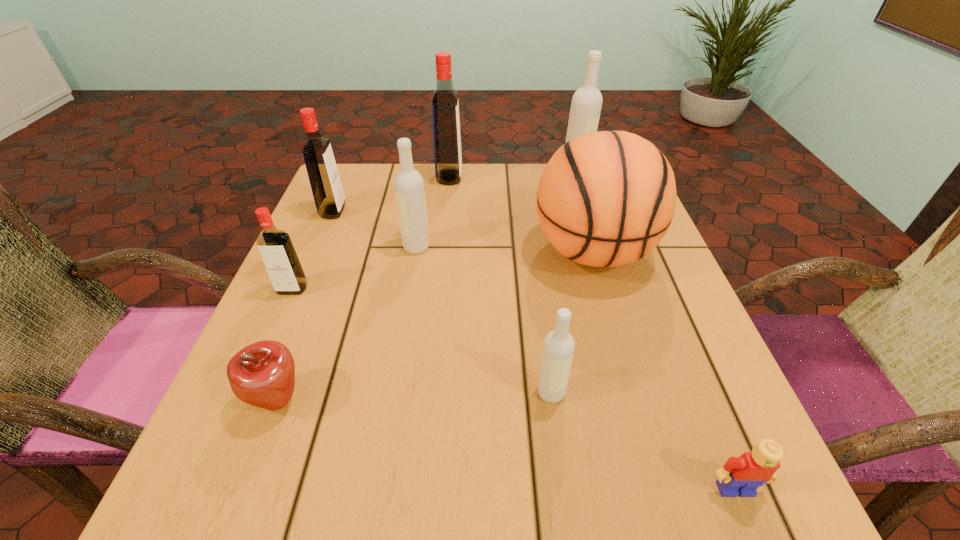
Locate an element on the screen. empty location between the second white vodka from right to left and the second nearest red vodka is located at coordinates (442, 302).

The image size is (960, 540). What are the coordinates of `free point between the biggest red vodka and the rightmost vodka` in the screenshot? It's located at (512, 176).

This screenshot has height=540, width=960. I want to click on blank region between the orange basketball and the apple, so click(x=435, y=326).

What are the coordinates of `vacant area that lies between the orange basketball and the farthest red vodka` in the screenshot? It's located at (520, 214).

Image resolution: width=960 pixels, height=540 pixels. I want to click on vacant area between the rightmost vodka and the third farthest vodka, so click(x=454, y=193).

The image size is (960, 540). I want to click on free space between the second farthest white vodka and the apple, so click(x=348, y=323).

This screenshot has width=960, height=540. In order to click on empty space that is in between the farthest white vodka and the fifth vodka from left to right in this screenshot , I will do `click(563, 284)`.

Where is `the eighth closest object to the farthest red vodka`? The width and height of the screenshot is (960, 540). the eighth closest object to the farthest red vodka is located at coordinates (742, 475).

Find the location of a particular element. This screenshot has width=960, height=540. object that can be found as the fifth closest to the apple is located at coordinates (327, 190).

Identify which vodka is the second nearest to the orange basketball. Please provide its 2D coordinates. Your answer should be formatted as a tuple, i.e. [(x, y)], where the tuple contains the x and y coordinates of a point satisfying the conditions above.

[(558, 348)]